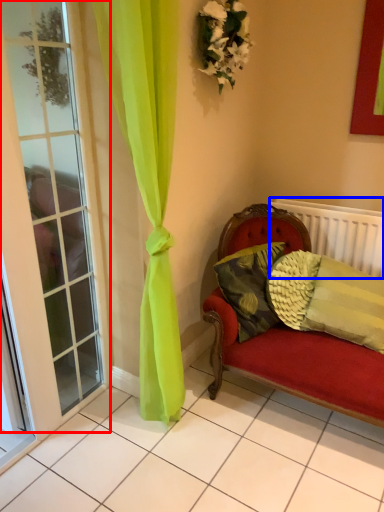
Question: Which object is closer to the camera taking this photo, window (highlighted by a red box) or radiator (highlighted by a blue box)?

Choices:
 (A) window
 (B) radiator

Answer: (A)